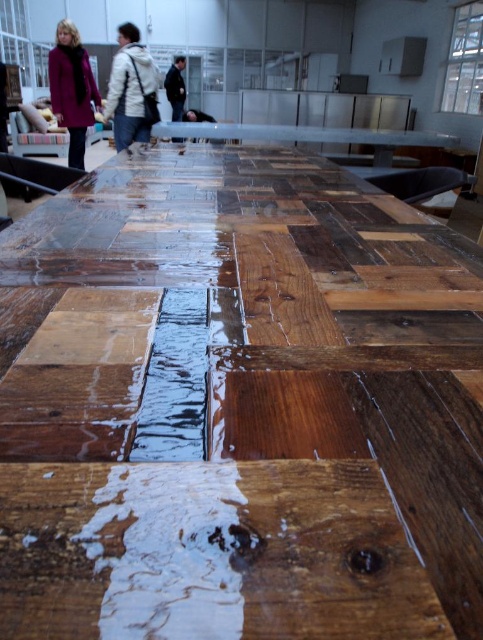
Can you confirm if wet wood plank at center is taller than white matte jacket at upper left?

Incorrect, wet wood plank at center's height is not larger of white matte jacket at upper left's.

Which is more to the right, wet wood plank at center or white matte jacket at upper left?

From the viewer's perspective, wet wood plank at center appears more on the right side.

At what (x,y) coordinates should I click in order to perform the action: click on wet wood plank at center. Please return your answer as a coordinate pair (x, y). This screenshot has height=640, width=483. Looking at the image, I should click on (208, 554).

Is matte purple coat at left above dark brown leather jacket at center?

No, matte purple coat at left is not above dark brown leather jacket at center.

Does matte purple coat at left have a lesser width compared to dark brown leather jacket at center?

In fact, matte purple coat at left might be wider than dark brown leather jacket at center.

Is point (69, 36) farther from viewer compared to point (206, 140)?

No, (69, 36) is closer to viewer.

Find the location of a particular element. matte purple coat at left is located at coordinates [x=71, y=90].

Is wooden table at center below dark blue jacket at center?

Yes.

Is point (263, 134) positioned after point (184, 58)?

No.

Image resolution: width=483 pixels, height=640 pixels. Find the location of `wooden table at center`. wooden table at center is located at coordinates (310, 136).